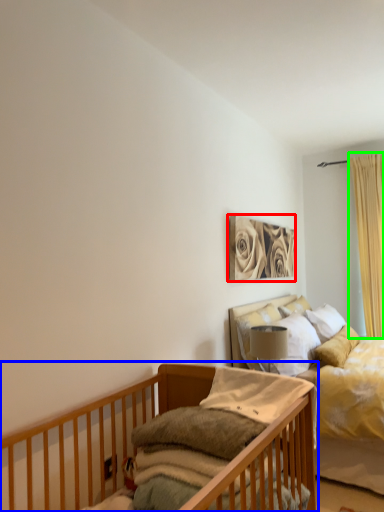
Question: Estimate the real-world distances between objects in this image. Which object is closer to picture frame (highlighted by a red box), infant bed (highlighted by a blue box) or curtain (highlighted by a green box)?

Choices:
 (A) infant bed
 (B) curtain

Answer: (B)